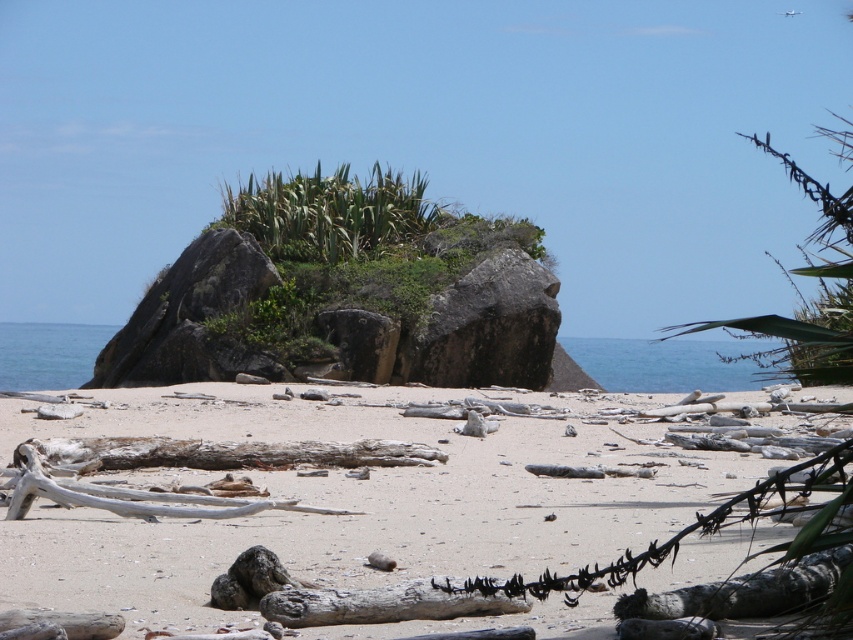
Does green leafy plant at center have a smaller size compared to charcoal textured log at lower right?

No, green leafy plant at center is not smaller than charcoal textured log at lower right.

Is the position of green leafy plant at center more distant than that of charcoal textured log at lower right?

That is True.

This screenshot has width=853, height=640. I want to click on green leafy plant at center, so click(331, 212).

Where is `green leafy plant at center`? The image size is (853, 640). green leafy plant at center is located at coordinates (331, 212).

Does point (399, 612) come closer to viewer compared to point (48, 364)?

Yes, point (399, 612) is in front of point (48, 364).

The width and height of the screenshot is (853, 640). Identify the location of gray weathered log at center. (381, 604).

Can you confirm if white sandy beach at center is positioned to the right of charcoal textured log at lower right?

No, white sandy beach at center is not to the right of charcoal textured log at lower right.

Can you confirm if white sandy beach at center is positioned to the left of charcoal textured log at lower right?

Indeed, white sandy beach at center is positioned on the left side of charcoal textured log at lower right.

You are a GUI agent. You are given a task and a screenshot of the screen. Output one action in this format:
    pyautogui.click(x=<x>, y=<y>)
    Task: Click on the white sandy beach at center
    This screenshot has width=853, height=640.
    Given the screenshot: What is the action you would take?
    pyautogui.click(x=349, y=502)